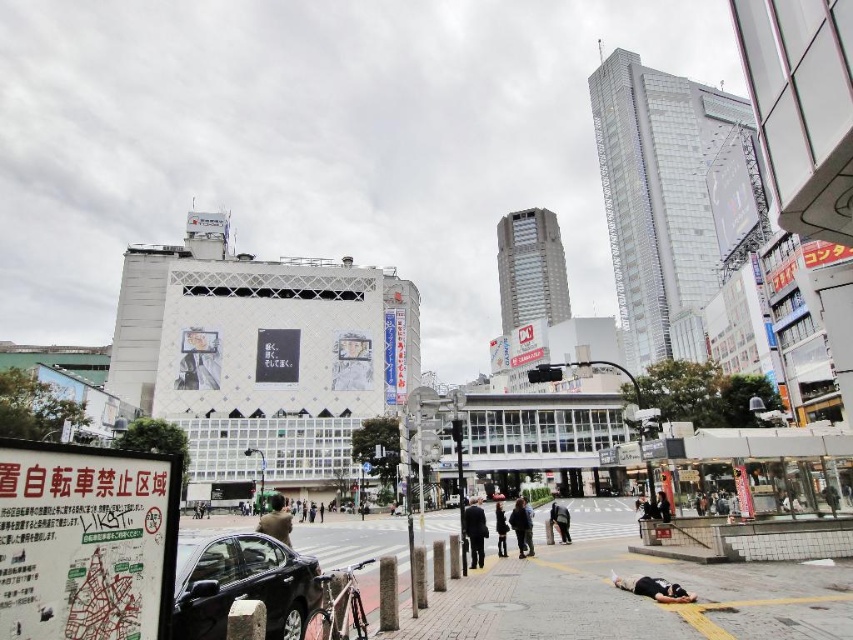
Question: Which object appears farthest from the camera in this image?

Choices:
 (A) dark gray jacket at lower center
 (B) dark gray fabric bag at lower center

Answer: (B)

Question: Is black fabric person at lower right below dark gray fabric coat at center?

Choices:
 (A) yes
 (B) no

Answer: (B)

Question: Can you confirm if shiny black sedan at lower left is bigger than dark gray jacket at lower center?

Choices:
 (A) no
 (B) yes

Answer: (A)

Question: Can you confirm if smooth concrete pavement at lower center is positioned above dark gray jacket at lower center?

Choices:
 (A) no
 (B) yes

Answer: (B)

Question: Among these points, which one is farthest from the camera?

Choices:
 (A) (186, 636)
 (B) (647, 506)
 (C) (575, 552)
 (D) (286, 532)

Answer: (B)

Question: Which object is the closest to the brown fabric jacket at center?

Choices:
 (A) black leather jacket at center
 (B) dark hair person at lower center
 (C) dark gray jacket at lower center

Answer: (A)